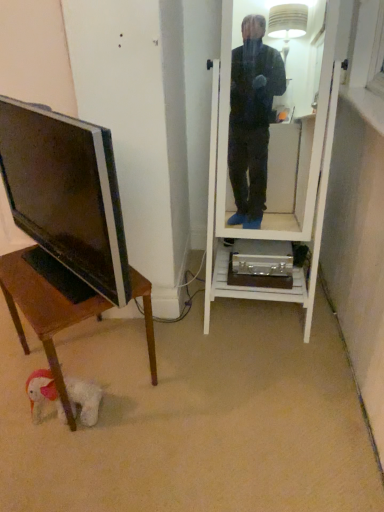
Question: Is there a large distance between matte black tv at left and wooden desk at lower left?

Choices:
 (A) no
 (B) yes

Answer: (A)

Question: Is matte black tv at left smaller than wooden desk at lower left?

Choices:
 (A) yes
 (B) no

Answer: (A)

Question: Can you confirm if matte black tv at left is wider than wooden desk at lower left?

Choices:
 (A) no
 (B) yes

Answer: (A)

Question: From a real-world perspective, is matte black tv at left positioned under wooden desk at lower left based on gravity?

Choices:
 (A) no
 (B) yes

Answer: (A)

Question: Does matte black tv at left turn towards wooden desk at lower left?

Choices:
 (A) no
 (B) yes

Answer: (A)

Question: From the image's perspective, is matte black tv at left positioned above or below white glossy mirror at center?

Choices:
 (A) above
 (B) below

Answer: (B)

Question: Considering the positions of matte black tv at left and white glossy mirror at center in the image, is matte black tv at left bigger or smaller than white glossy mirror at center?

Choices:
 (A) small
 (B) big

Answer: (A)

Question: Is matte black tv at left to the left or to the right of white glossy mirror at center in the image?

Choices:
 (A) left
 (B) right

Answer: (A)

Question: Considering the positions of matte black tv at left and white glossy mirror at center in the image, is matte black tv at left taller or shorter than white glossy mirror at center?

Choices:
 (A) short
 (B) tall

Answer: (A)

Question: Is matte black tv at left to the left or to the right of wooden desk at lower left in the image?

Choices:
 (A) right
 (B) left

Answer: (B)

Question: Is matte black tv at left situated inside wooden desk at lower left or outside?

Choices:
 (A) inside
 (B) outside

Answer: (B)

Question: From the image's perspective, is matte black tv at left located above or below wooden desk at lower left?

Choices:
 (A) below
 (B) above

Answer: (B)

Question: Looking at the image, does matte black tv at left seem bigger or smaller compared to wooden desk at lower left?

Choices:
 (A) big
 (B) small

Answer: (B)

Question: Considering the positions of point (57, 292) and point (233, 10), is point (57, 292) closer or farther from the camera than point (233, 10)?

Choices:
 (A) closer
 (B) farther

Answer: (A)

Question: In the image, is wooden desk at lower left positioned in front of or behind white glossy mirror at center?

Choices:
 (A) front
 (B) behind

Answer: (B)